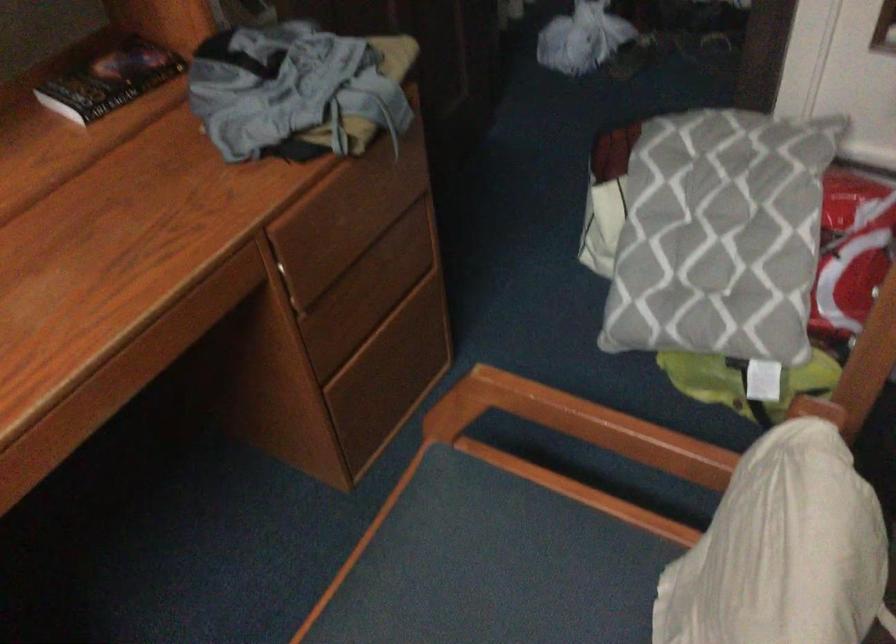
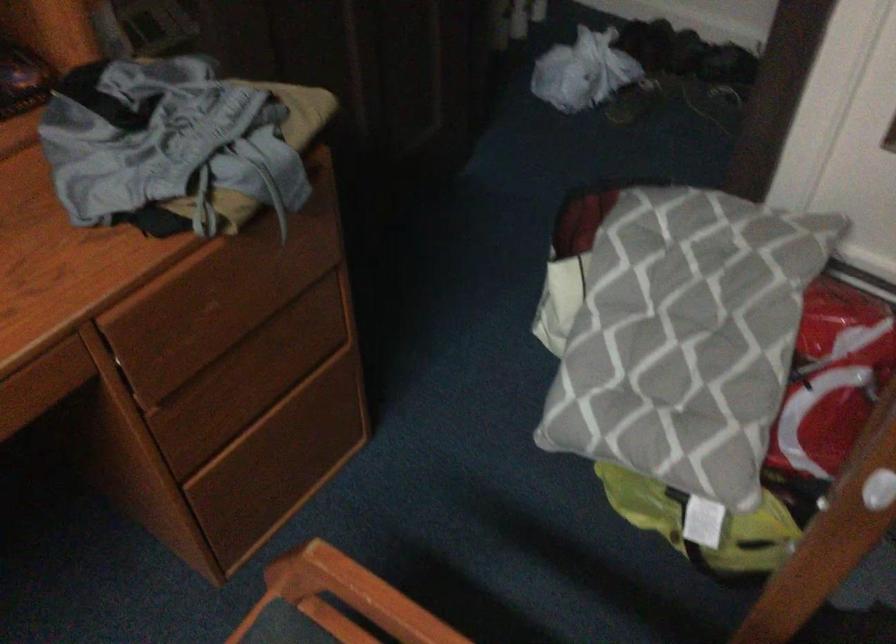
Locate, in the second image, the point that corresponds to point 367,296 in the first image.

(254, 377)